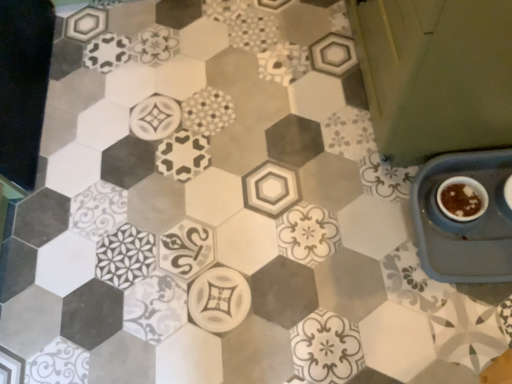
Image resolution: width=512 pixels, height=384 pixels. Find the location of `white ceramic bowl at right`. white ceramic bowl at right is located at coordinates (463, 222).

In order to face white ceramic bowl at right, should I rotate leftwards or rightwards?

You should rotate right by 27.251 degrees.

The height and width of the screenshot is (384, 512). What do you see at coordinates (463, 222) in the screenshot?
I see `white ceramic bowl at right` at bounding box center [463, 222].

In order to click on white ceramic bowl at right in this screenshot , I will do `click(463, 222)`.